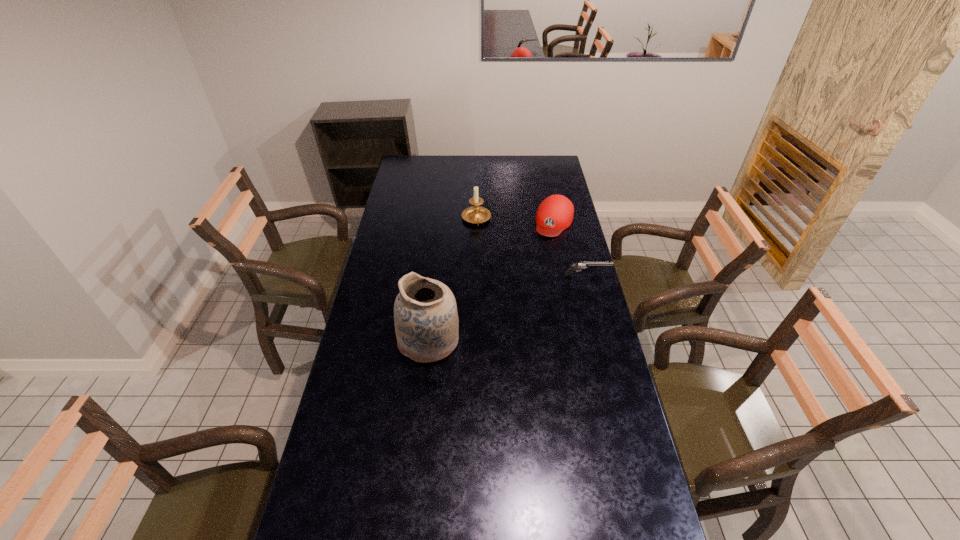
Identify the location of free space located with a handle on the side of the candle holder. Image resolution: width=960 pixels, height=540 pixels. (483, 244).

This screenshot has height=540, width=960. I want to click on free space located with a handle on the side of the candle holder, so click(485, 253).

At what (x,y) coordinates should I click in order to perform the action: click on vacant space located 0.310m with a handle on the side of the candle holder. Please return your answer as a coordinate pair (x, y). This screenshot has height=540, width=960. Looking at the image, I should click on (492, 274).

Where is `object that is at the left edge`? This screenshot has width=960, height=540. object that is at the left edge is located at coordinates point(426,321).

This screenshot has height=540, width=960. I want to click on pistol that is at the right edge, so tap(581, 265).

Where is `baseball cap present at the right edge`? The width and height of the screenshot is (960, 540). baseball cap present at the right edge is located at coordinates (555, 213).

In the image, there is a desktop. Find the location of `vacant space at the far edge`. vacant space at the far edge is located at coordinates (462, 166).

In order to click on vacant space at the left edge in this screenshot , I will do `click(352, 484)`.

In the image, there is a desktop. At what (x,y) coordinates should I click in order to perform the action: click on vacant space at the right edge. Please return your answer as a coordinate pair (x, y). The height and width of the screenshot is (540, 960). Looking at the image, I should click on (538, 180).

In the image, there is a desktop. What are the coordinates of `vacant space at the far left corner` in the screenshot? It's located at (397, 177).